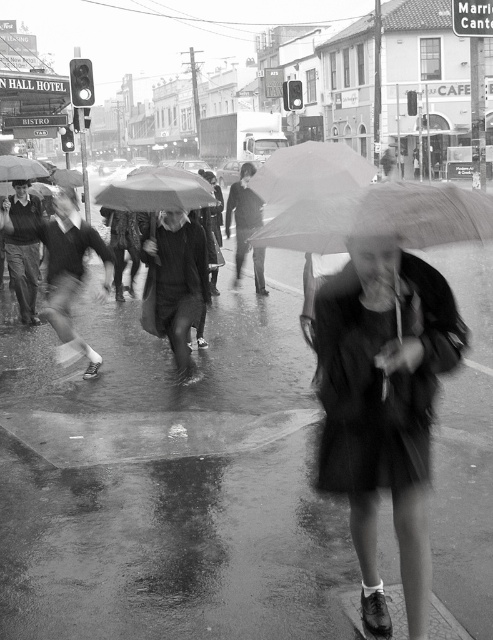
Question: Which point is closer to the camera?

Choices:
 (A) matte black sweater at left
 (B) matte black jacket at left

Answer: (A)

Question: Is dark fabric umbrella at center further to camera compared to matte black umbrella at center?

Choices:
 (A) yes
 (B) no

Answer: (B)

Question: Is wet asphalt pavement at center further to the viewer compared to leather jacket at center?

Choices:
 (A) no
 (B) yes

Answer: (A)

Question: Among these points, which one is farthest from the camera?

Choices:
 (A) (135, 269)
 (B) (10, 216)
 (C) (209, 257)
 (D) (422, 632)

Answer: (A)

Question: Estimate the real-world distances between objects in this image. Which object is farther from the matte black umbrella at center?

Choices:
 (A) black matte coat at center
 (B) matte black sweater at left

Answer: (A)

Question: Can you confirm if wet asphalt pavement at center is smaller than leather jacket at center?

Choices:
 (A) no
 (B) yes

Answer: (B)